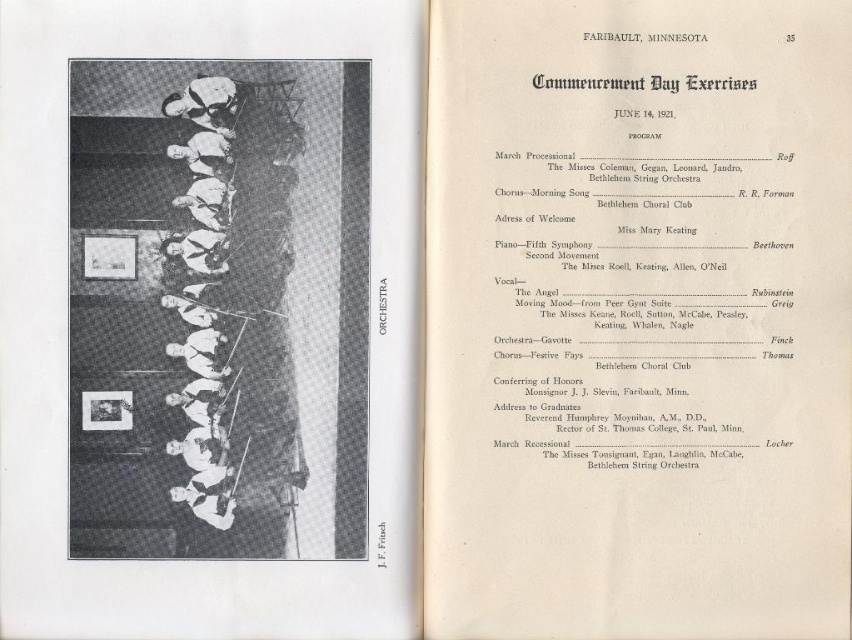
Can you confirm if white paper menu at upper center is positioned to the right of white matte orchestra at center?

Indeed, white paper menu at upper center is positioned on the right side of white matte orchestra at center.

Can you confirm if white paper menu at upper center is positioned below white matte orchestra at center?

Yes.

Looking at this image, who is more distant from viewer, (619, 484) or (137, 554)?

Positioned behind is point (619, 484).

Identify the location of white paper menu at upper center. (637, 317).